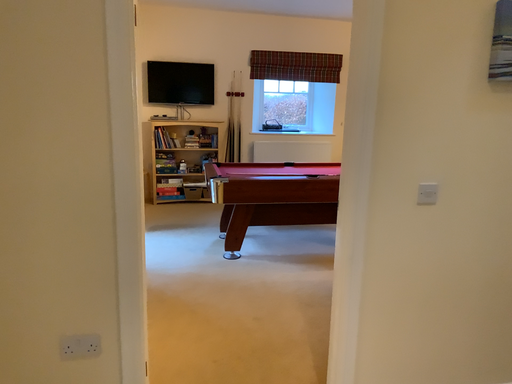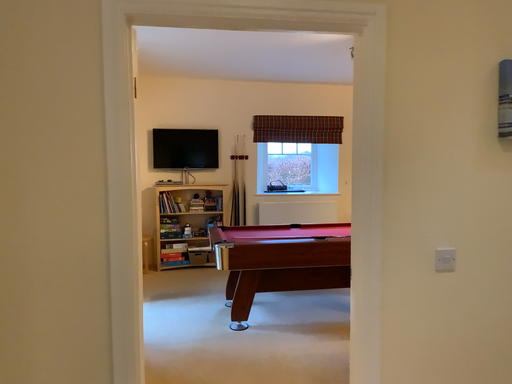
Question: Which way did the camera rotate in the video?

Choices:
 (A) rotated upward
 (B) rotated downward

Answer: (A)